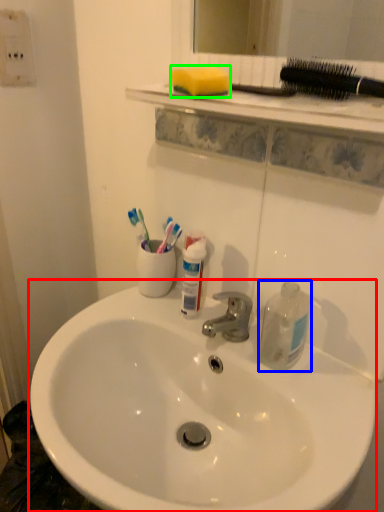
Question: Based on their relative distances, which object is nearer to sink (highlighted by a red box)? Choose from cleaning product (highlighted by a blue box) and soap (highlighted by a green box).

Choices:
 (A) cleaning product
 (B) soap

Answer: (A)